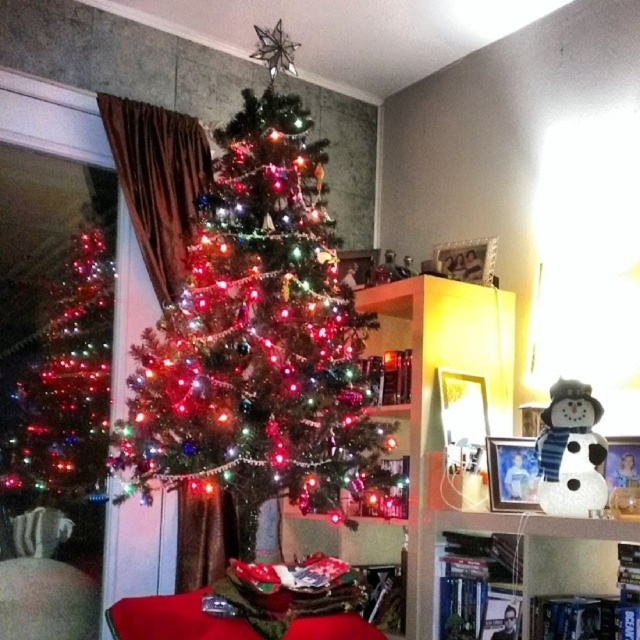
Does wooden bookshelf at center have a lesser width compared to shiny metallic christmas tree at left?

Incorrect, wooden bookshelf at center's width is not less than shiny metallic christmas tree at left's.

Does wooden bookshelf at center have a greater width compared to shiny metallic christmas tree at left?

Indeed, wooden bookshelf at center has a greater width compared to shiny metallic christmas tree at left.

Does point (396, 285) come farther from viewer compared to point (64, 476)?

Yes, it is behind point (64, 476).

In order to click on wooden bookshelf at center in this screenshot , I will do `click(440, 396)`.

Which is above, iridescent shiny christmas tree at center or shiny metallic christmas tree at left?

iridescent shiny christmas tree at center

The height and width of the screenshot is (640, 640). I want to click on iridescent shiny christmas tree at center, so click(x=257, y=336).

Does iridescent shiny christmas tree at center have a smaller size compared to wooden bookshelf at center?

Actually, iridescent shiny christmas tree at center might be larger than wooden bookshelf at center.

In the scene shown: Does iridescent shiny christmas tree at center appear on the right side of wooden bookshelf at center?

In fact, iridescent shiny christmas tree at center is to the left of wooden bookshelf at center.

Which is in front, point (268, 436) or point (428, 605)?

Positioned in front is point (268, 436).

I want to click on iridescent shiny christmas tree at center, so click(x=257, y=336).